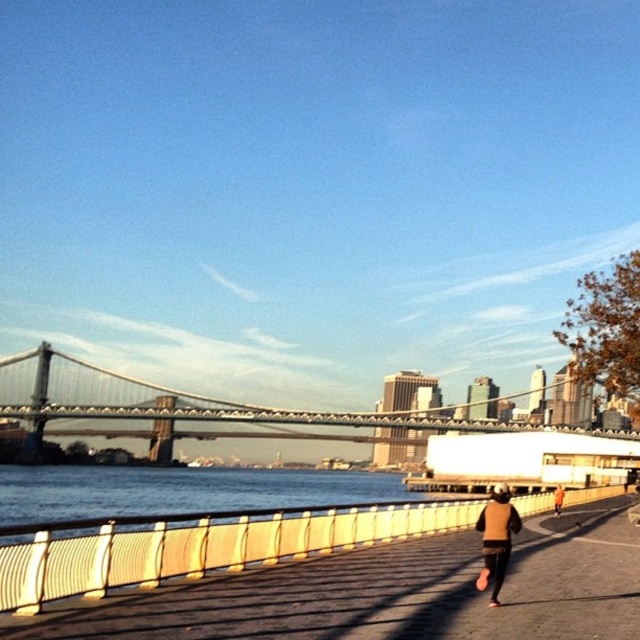
Does metallic gray suspension bridge at center have a smaller size compared to brown suede jacket at lower right?

No, metallic gray suspension bridge at center is not smaller than brown suede jacket at lower right.

Locate an element on the screen. This screenshot has height=640, width=640. metallic gray suspension bridge at center is located at coordinates (209, 404).

Measure the distance from wooden boardwalk at center to brown suede jacket at lower right.

The distance of wooden boardwalk at center from brown suede jacket at lower right is 5.49 meters.

Is point (458, 560) positioned after point (506, 554)?

Yes.

Find the location of a particular element. wooden boardwalk at center is located at coordinates (387, 593).

Between wooden boardwalk at center and metallic gray suspension bridge at center, which one is positioned higher?

wooden boardwalk at center is higher up.

Who is more distant from viewer, (620, 536) or (412, 436)?

Point (412, 436)

I want to click on wooden boardwalk at center, so tap(387, 593).